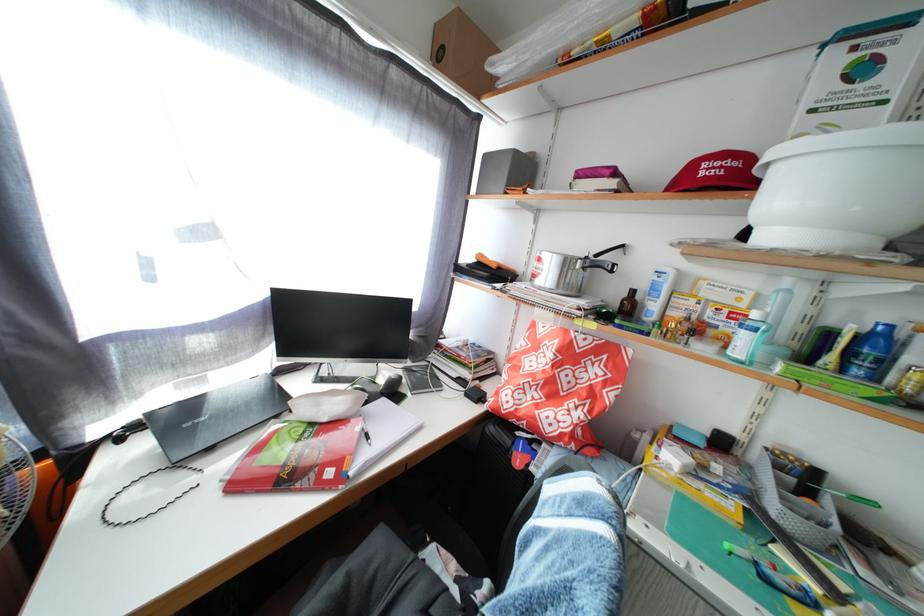
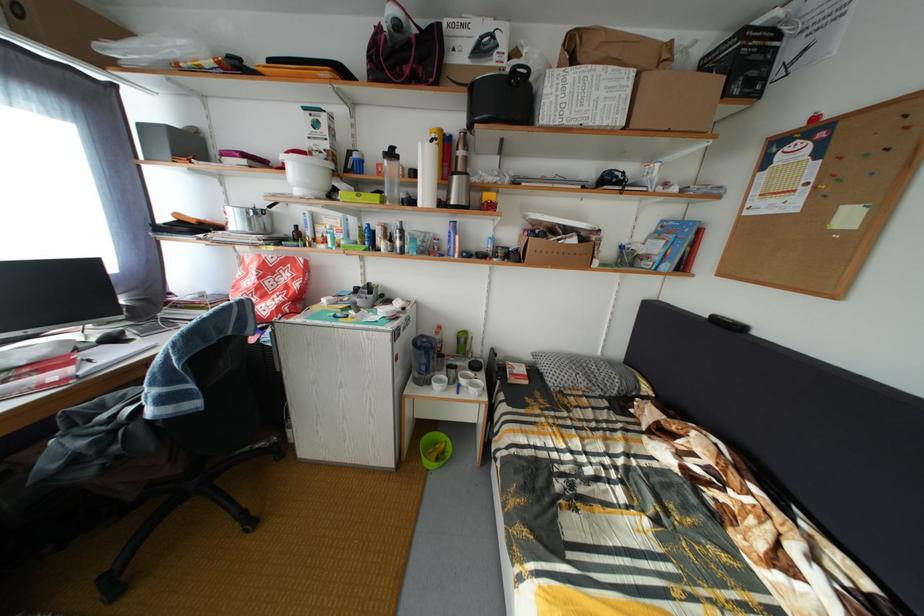
The point at (x=334, y=427) is marked in the first image. Where is the corresponding point in the second image?

(31, 370)